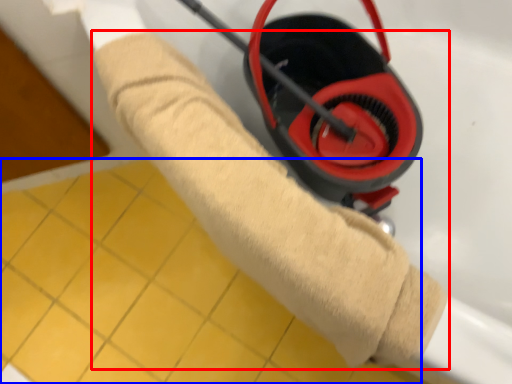
Question: Among these objects, which one is nearest to the camera, towel (highlighted by a red box) or tile (highlighted by a blue box)?

Choices:
 (A) towel
 (B) tile

Answer: (A)